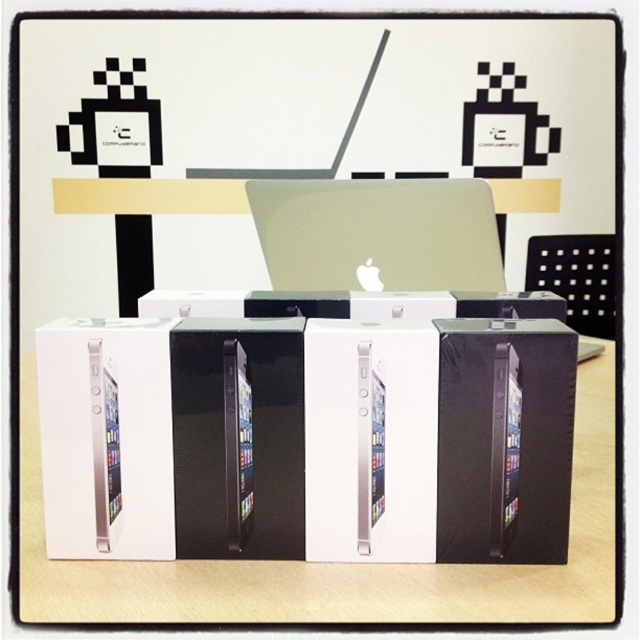
Question: Which point is farther to the camera?

Choices:
 (A) (29, 557)
 (B) (474, 244)

Answer: (B)

Question: Among these points, which one is nearest to the camera?

Choices:
 (A) (595, 436)
 (B) (417, 193)

Answer: (A)

Question: Is white cardboard boxes at center thinner than satin silver laptop at center?

Choices:
 (A) yes
 (B) no

Answer: (B)

Question: Does white cardboard boxes at center come behind satin silver laptop at center?

Choices:
 (A) yes
 (B) no

Answer: (B)

Question: Is white cardboard boxes at center to the right of satin silver laptop at center from the viewer's perspective?

Choices:
 (A) yes
 (B) no

Answer: (B)

Question: Which point appears closest to the camera in this image?

Choices:
 (A) (164, 564)
 (B) (289, 202)

Answer: (A)